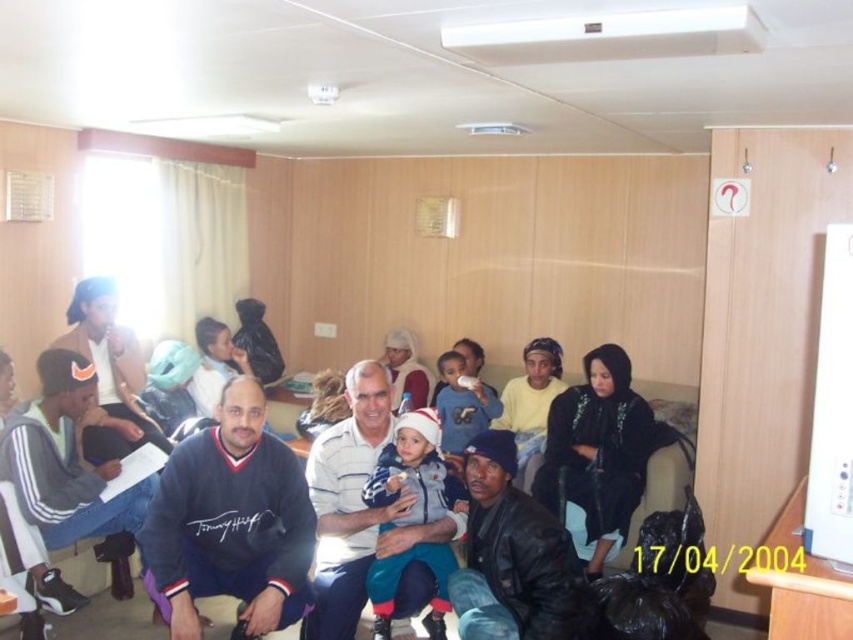
Question: Estimate the real-world distances between objects in this image. Which object is closer to the black leather jacket at lower center?

Choices:
 (A) blue cotton shirt at center
 (B) white cotton shirt at center
 (C) dark blue sweater at lower left

Answer: (B)

Question: Is dark blue sweater at center positioned in front of matte blue jacket at center?

Choices:
 (A) no
 (B) yes

Answer: (A)

Question: In this image, where is black leather jacket at lower center located relative to white cotton shirt at center?

Choices:
 (A) left
 (B) right

Answer: (B)

Question: Can you confirm if dark blue sweater at center is positioned below blue cotton shirt at center?

Choices:
 (A) no
 (B) yes

Answer: (A)

Question: Which point appears farthest from the camera in this image?

Choices:
 (A) (503, 624)
 (B) (347, 392)

Answer: (B)

Question: Which point is farther to the camera?

Choices:
 (A) (492, 429)
 (B) (466, 417)
 (C) (286, 609)

Answer: (B)